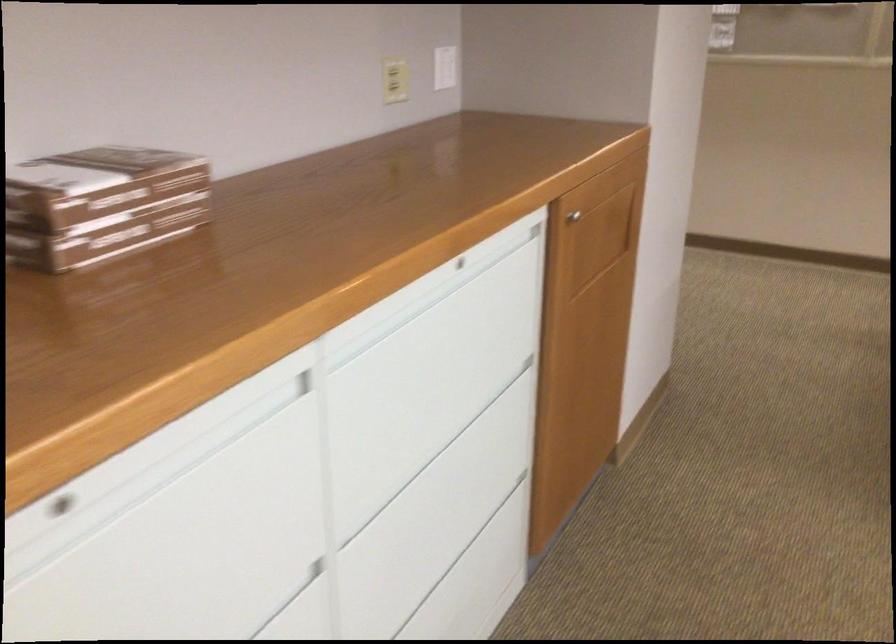
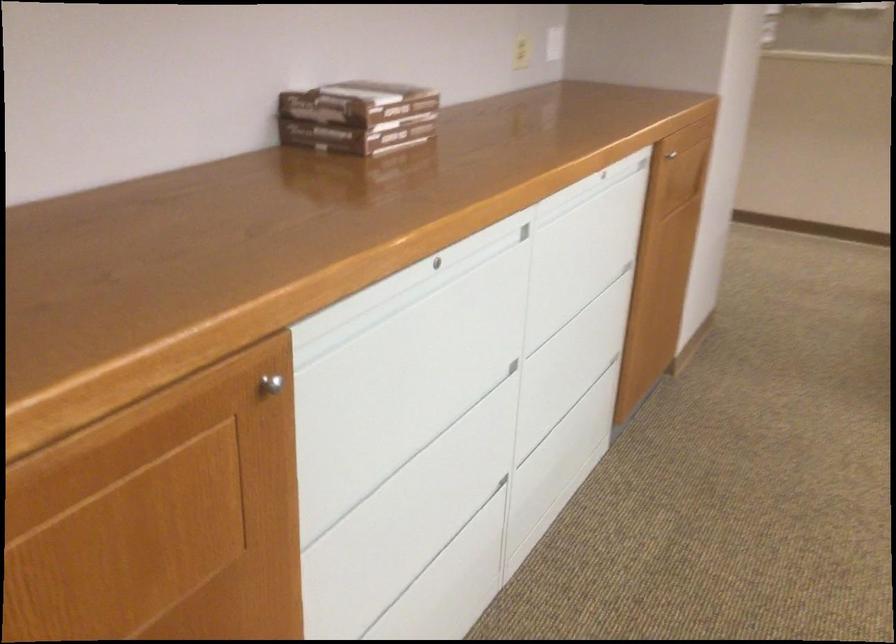
Find the pixel in the second image that matches [449,281] in the first image.

(591, 185)